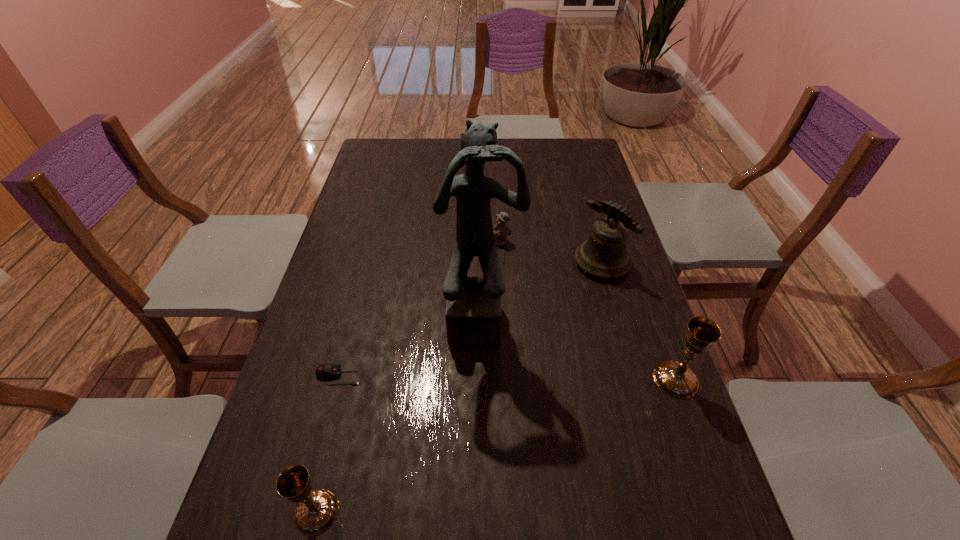
I want to click on the nearer chalice, so click(316, 511).

You are a GUI agent. You are given a task and a screenshot of the screen. Output one action in this format:
    pyautogui.click(x=<x>, y=<y>)
    Task: Click on the shorter chalice
    The width and height of the screenshot is (960, 540).
    Given the screenshot: What is the action you would take?
    pyautogui.click(x=316, y=511)

At what (x,y) coordinates should I click in order to perform the action: click on the farther chalice. Please return your answer as a coordinate pair (x, y). Looking at the image, I should click on (675, 378).

Locate an element on the screen. the right chalice is located at coordinates (675, 378).

You are a GUI agent. You are given a task and a screenshot of the screen. Output one action in this format:
    pyautogui.click(x=<x>, y=<y>)
    Task: Click on the second shortest object
    Image resolution: width=960 pixels, height=540 pixels.
    Given the screenshot: What is the action you would take?
    pyautogui.click(x=501, y=230)

Identify the location of bell. The image size is (960, 540). (604, 254).

Identify the location of mouse. (325, 371).

Where is `the fourth nearest object`? This screenshot has width=960, height=540. the fourth nearest object is located at coordinates (473, 314).

Where is `sculpture`? Image resolution: width=960 pixels, height=540 pixels. sculpture is located at coordinates 473,314.

Identify the location of free region located 0.090m on the right of the left chalice. (387, 512).